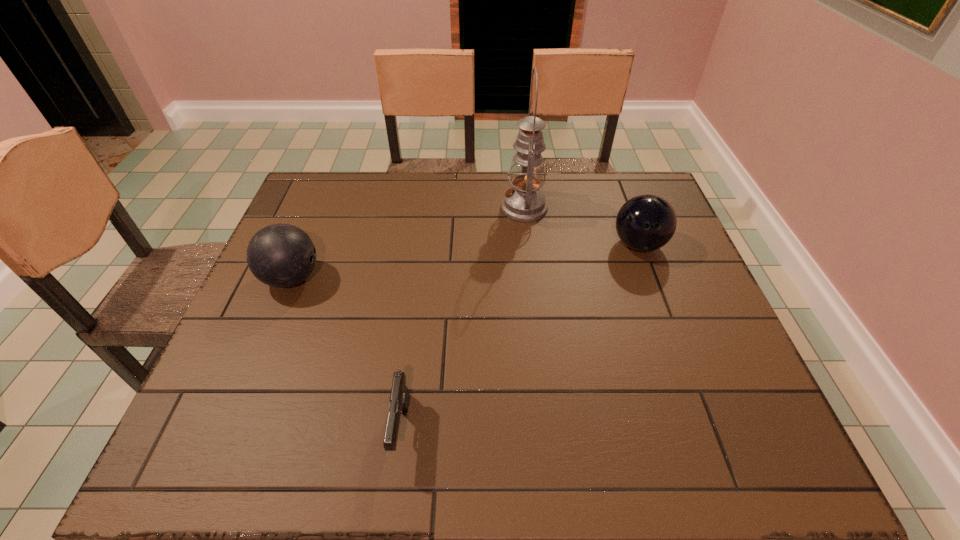
This screenshot has height=540, width=960. In order to click on vacant region between the shortest object and the right bowling ball in this screenshot , I will do `click(520, 337)`.

The width and height of the screenshot is (960, 540). Find the location of `vacant region between the right bowling ball and the pistol`. vacant region between the right bowling ball and the pistol is located at coordinates (520, 337).

Find the location of a particular element. free spot between the nearest object and the rightmost object is located at coordinates (520, 337).

Find the location of a particular element. The height and width of the screenshot is (540, 960). free space between the second object from right to left and the leftmost object is located at coordinates (408, 243).

Find the location of `vacant region between the farthest object and the rightmost object`. vacant region between the farthest object and the rightmost object is located at coordinates (581, 226).

This screenshot has height=540, width=960. In order to click on empty space between the oil lamp and the third object from right to left in this screenshot , I will do `click(463, 319)`.

At what (x,y) coordinates should I click in order to perform the action: click on empty space between the third object from left to right and the left bowling ball. Please return your answer as a coordinate pair (x, y). Looking at the image, I should click on (x=408, y=243).

Find the location of `vacant area that lies between the right bowling ball and the left bowling ball`. vacant area that lies between the right bowling ball and the left bowling ball is located at coordinates (466, 261).

Identify the location of vacant area that lies between the leftmost object and the rightmost object. (466, 261).

Identify the location of empty space between the pistol and the leftmost object. (347, 354).